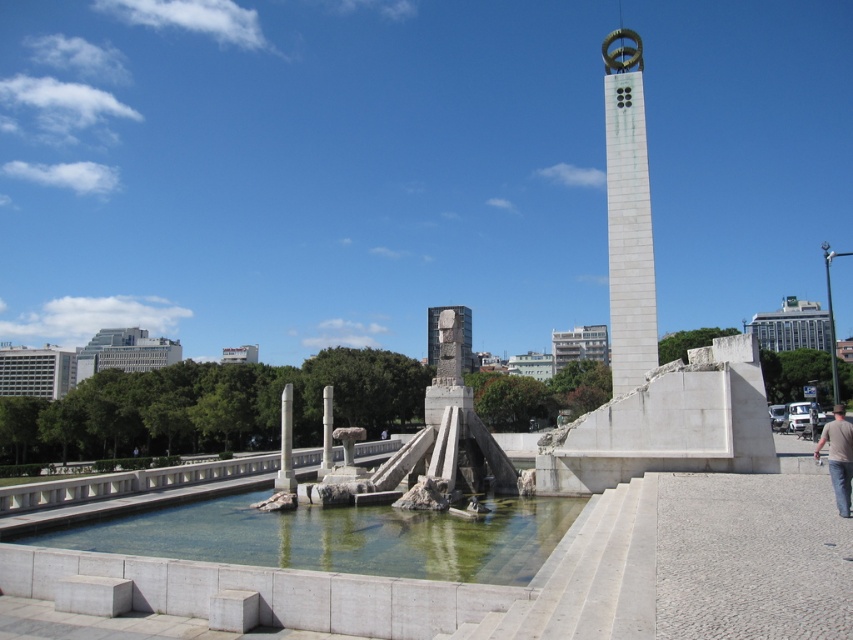
Question: Among these objects, which one is farthest from the camera?

Choices:
 (A) white marble bell tower at upper center
 (B) brown cotton shirt at lower right
 (C) clear glass water at center

Answer: (A)

Question: Which object appears farthest from the camera in this image?

Choices:
 (A) clear glass water at center
 (B) white marble bell tower at upper center

Answer: (B)

Question: Can you confirm if white marble bell tower at upper center is thinner than brown cotton shirt at lower right?

Choices:
 (A) no
 (B) yes

Answer: (A)

Question: Which object appears closest to the camera in this image?

Choices:
 (A) white marble bell tower at upper center
 (B) brown cotton shirt at lower right

Answer: (B)

Question: Is clear glass water at center wider than brown cotton shirt at lower right?

Choices:
 (A) no
 (B) yes

Answer: (B)

Question: Is white marble bell tower at upper center below brown cotton shirt at lower right?

Choices:
 (A) no
 (B) yes

Answer: (A)